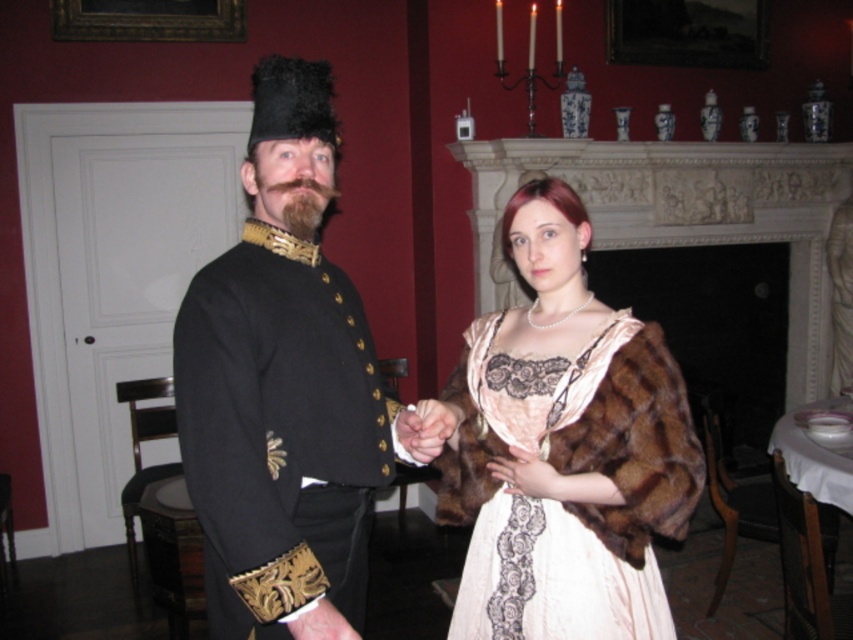
Question: Is velvet beige dress with lace at center above brown fur hand at center?

Choices:
 (A) no
 (B) yes

Answer: (B)

Question: Which of the following is the closest to the observer?

Choices:
 (A) velvet beige dress with lace at center
 (B) velvet black coat at left

Answer: (B)

Question: Does velvet beige dress with lace at center appear over brown fur hand at center?

Choices:
 (A) no
 (B) yes

Answer: (B)

Question: Among these points, which one is farthest from the camera?

Choices:
 (A) (567, 636)
 (B) (665, 524)
 (C) (334, 593)
 (D) (532, 496)

Answer: (D)

Question: Can you confirm if velvet beige dress with lace at center is thinner than brown fur hand at center?

Choices:
 (A) yes
 (B) no

Answer: (B)

Question: Which of the following is the farthest from the observer?

Choices:
 (A) velvet black coat at left
 (B) velvet beige dress with lace at center
 (C) black wool military uniform at center

Answer: (B)